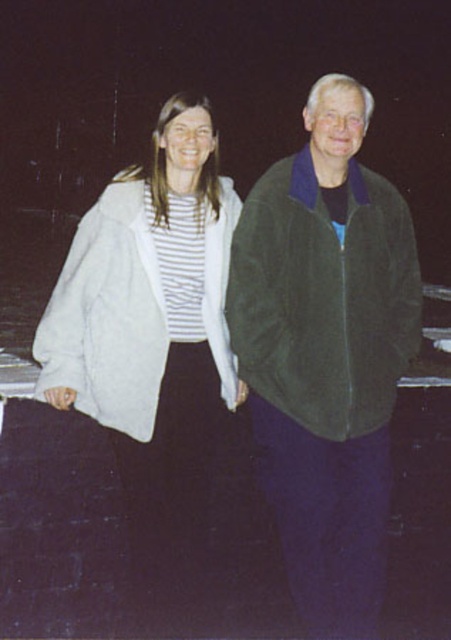
Can you confirm if dark green suede jacket at right is thinner than white fuzzy jacket at center?

Yes.

Describe the element at coordinates (326, 353) in the screenshot. I see `dark green suede jacket at right` at that location.

Who is more distant from viewer, (x=389, y=202) or (x=170, y=198)?

Positioned behind is point (x=389, y=202).

You are a GUI agent. You are given a task and a screenshot of the screen. Output one action in this format:
    pyautogui.click(x=<x>, y=<y>)
    Task: Click on the dark green suede jacket at right
    The image size is (451, 640).
    Given the screenshot: What is the action you would take?
    pyautogui.click(x=326, y=353)